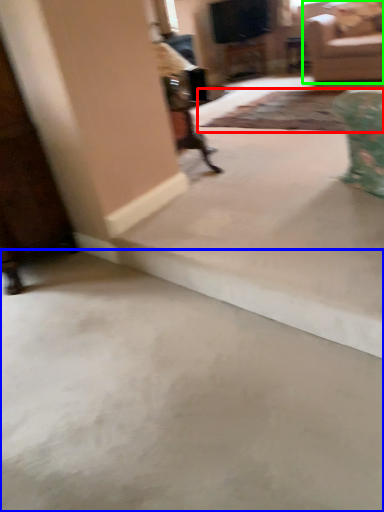
Question: Which is nearer to the mat (highlighted by a red box)? concrete (highlighted by a blue box) or studio couch (highlighted by a green box).

Choices:
 (A) concrete
 (B) studio couch

Answer: (B)